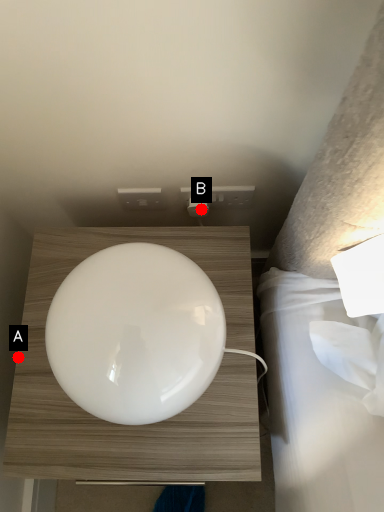
Question: Two points are circled on the image, labeled by A and B beside each circle. Among these points, which one is farthest from the camera?

Choices:
 (A) A is further
 (B) B is further

Answer: (B)